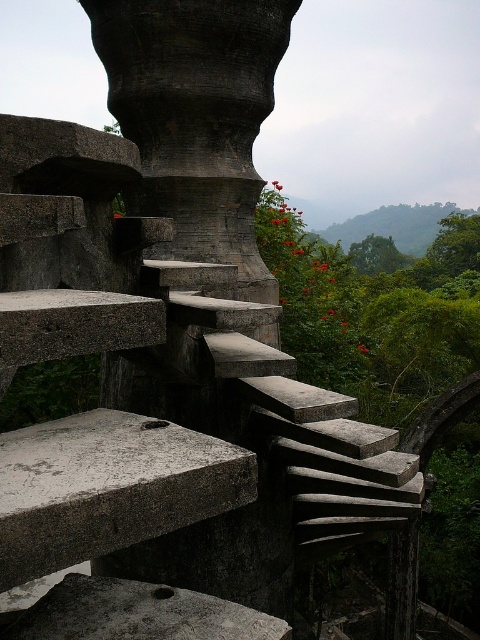
Does dark gray stone pillar at center appear under gray concrete at lower left?

No.

Find the location of a particular element. This screenshot has height=640, width=480. dark gray stone pillar at center is located at coordinates (195, 115).

Can you confirm if gray concrete stairs at center is taller than gray concrete at lower left?

Correct, gray concrete stairs at center is much taller as gray concrete at lower left.

Who is more distant from viewer, [108,547] or [196,621]?

Point [196,621]

Locate an element on the screen. This screenshot has width=480, height=640. gray concrete stairs at center is located at coordinates (108, 486).

Is dark gray stone pillar at center to the left of gray concrete stairs at center from the viewer's perspective?

Incorrect, dark gray stone pillar at center is not on the left side of gray concrete stairs at center.

Based on the photo, is dark gray stone pillar at center above gray concrete stairs at center?

Correct, dark gray stone pillar at center is located above gray concrete stairs at center.

Between point (286, 13) and point (24, 576), which one is positioned in front?

Positioned in front is point (24, 576).

Image resolution: width=480 pixels, height=640 pixels. Find the location of `dark gray stone pillar at center`. dark gray stone pillar at center is located at coordinates (195, 115).